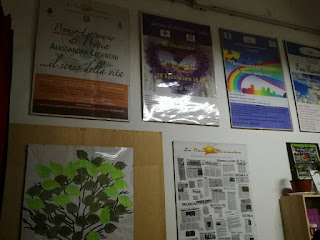
At what (x,y) coordinates should I click in order to perform the action: click on rainbow on poster. Please return your answer as a coordinate pair (x, y). Looking at the image, I should click on (235, 76).